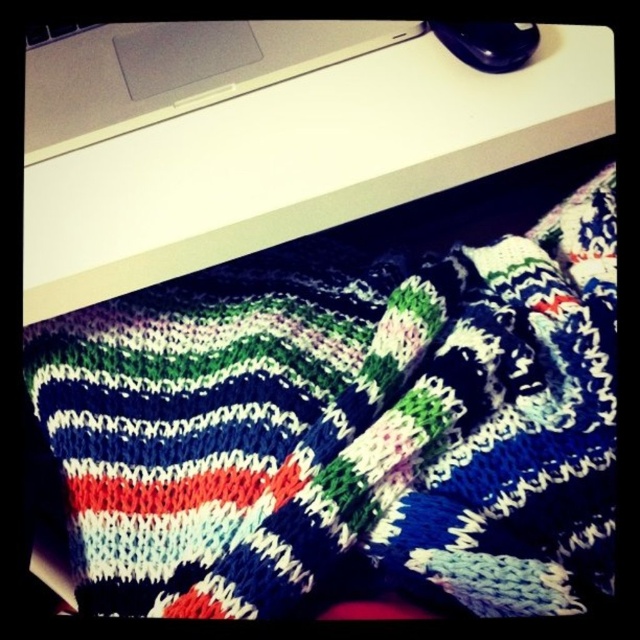
Question: Among these objects, which one is farthest from the camera?

Choices:
 (A) knitted woolen sock at center
 (B) white matte laptop at upper center

Answer: (B)

Question: Can you confirm if white plastic computer desk at upper center is positioned below knitted woolen sock at center?

Choices:
 (A) yes
 (B) no

Answer: (B)

Question: In this image, where is knitted woolen sock at center located relative to white matte laptop at upper center?

Choices:
 (A) right
 (B) left

Answer: (A)

Question: Which object appears closest to the camera in this image?

Choices:
 (A) knitted woolen sock at center
 (B) white plastic computer desk at upper center

Answer: (A)

Question: Can you confirm if white plastic computer desk at upper center is smaller than white matte laptop at upper center?

Choices:
 (A) no
 (B) yes

Answer: (A)

Question: Which point appears farthest from the camera in this image?

Choices:
 (A) (108, 106)
 (B) (378, 502)

Answer: (A)